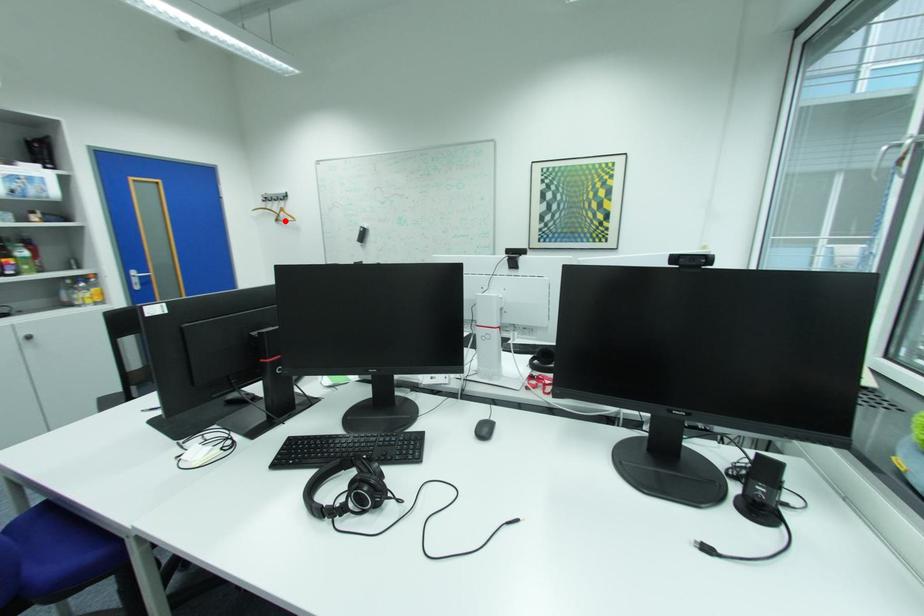
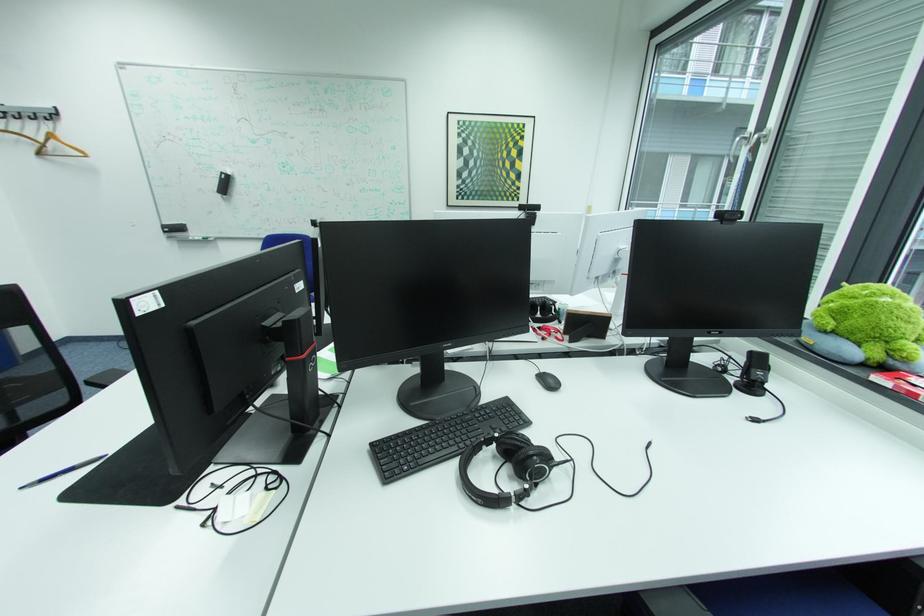
Find the pixel in the second image that matches the highlighted location in the first image.

(49, 153)